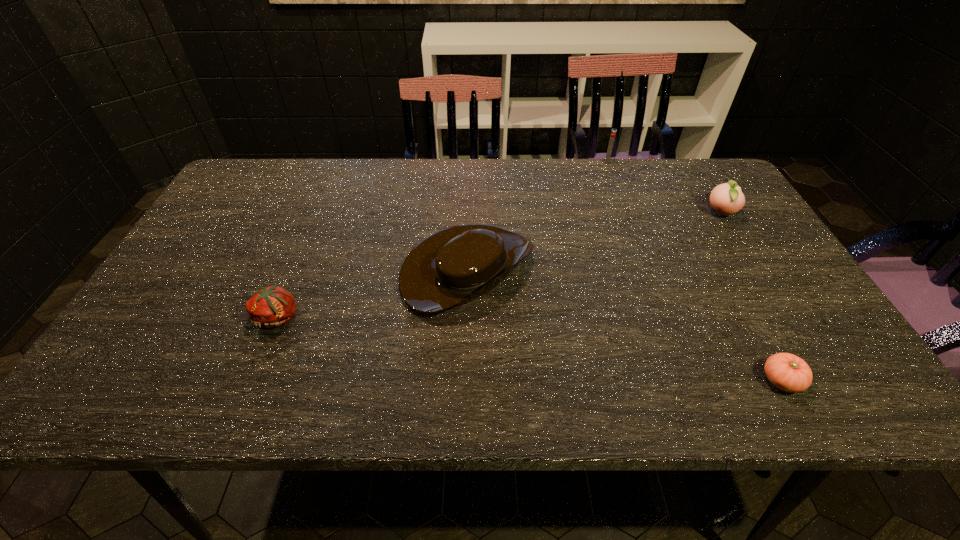
This screenshot has height=540, width=960. In order to click on vacant space at the left edge of the desktop in this screenshot , I will do `click(169, 276)`.

Identify the location of free space between the cowboy hat and the peach. (594, 241).

In order to click on empty space that is in between the shortest object and the peach in this screenshot , I will do `click(751, 297)`.

Where is `free space between the cowboy hat and the third object from left to right`? The height and width of the screenshot is (540, 960). free space between the cowboy hat and the third object from left to right is located at coordinates tap(538, 215).

Find the location of a particular element. free space that is in between the right tomato and the igniter is located at coordinates (694, 271).

At what (x,y) coordinates should I click in order to perform the action: click on free space between the peach and the farthest object. Please return your answer as a coordinate pair (x, y). This screenshot has width=960, height=540. Looking at the image, I should click on (663, 188).

The image size is (960, 540). Identify the location of free space between the igniter and the right tomato. (694, 271).

At what (x,y) coordinates should I click in order to perform the action: click on empty space that is in between the cowboy hat and the second farthest object. Please return your answer as a coordinate pair (x, y). This screenshot has width=960, height=540. Looking at the image, I should click on (594, 241).

Locate which object ranks in proximity to the second object from left to right. Please provide its 2D coordinates. Your answer should be formatted as a tuple, i.e. [(x, y)], where the tuple contains the x and y coordinates of a point satisfying the conditions above.

[(273, 306)]

Locate an element on the screen. The height and width of the screenshot is (540, 960). object that is the fourth closest to the shorter tomato is located at coordinates (273, 306).